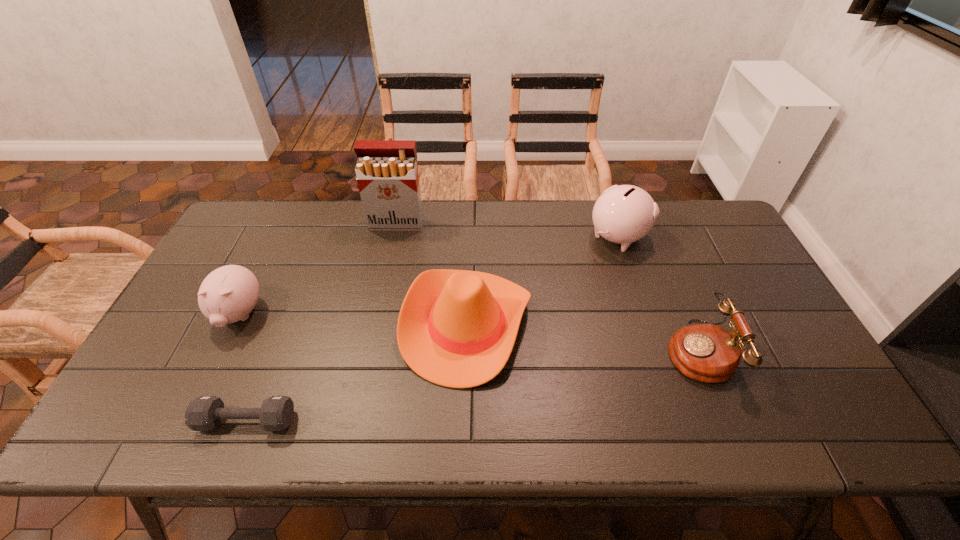
Where is `cigarette case`? cigarette case is located at coordinates (387, 174).

Where is `the taller piggy bank`? This screenshot has height=540, width=960. the taller piggy bank is located at coordinates (623, 214).

Identify the location of the right piggy bank. The image size is (960, 540). (623, 214).

The width and height of the screenshot is (960, 540). I want to click on cowboy hat, so click(x=456, y=328).

The width and height of the screenshot is (960, 540). I want to click on telephone, so click(x=708, y=353).

This screenshot has width=960, height=540. I want to click on the left piggy bank, so click(228, 294).

Image resolution: width=960 pixels, height=540 pixels. I want to click on the shorter piggy bank, so click(228, 294).

The height and width of the screenshot is (540, 960). Find the location of `the shortest object`. the shortest object is located at coordinates (204, 413).

I want to click on dumbbell, so pyautogui.click(x=204, y=413).

Locate an element on the screen. free spot located with the lid open on the cigarette case is located at coordinates (387, 269).